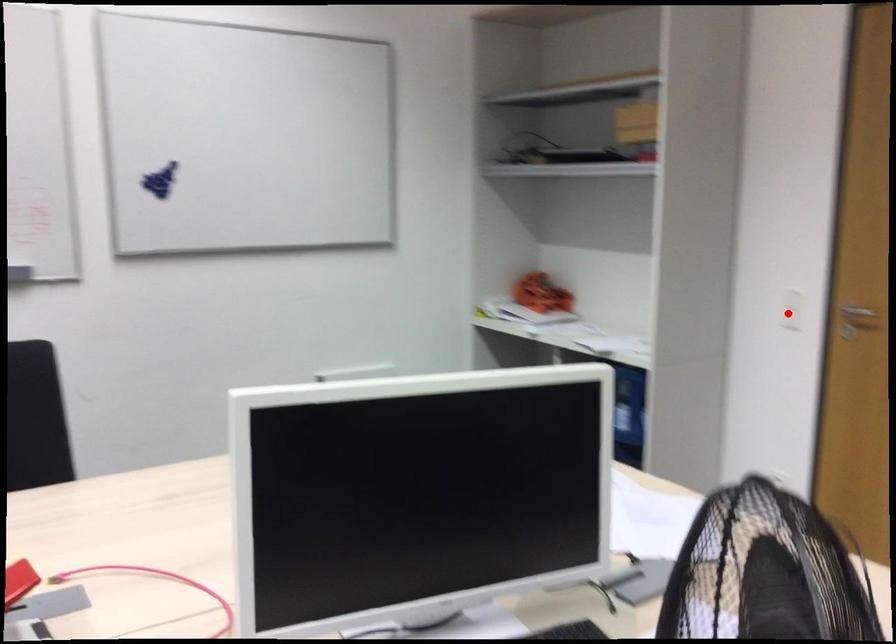
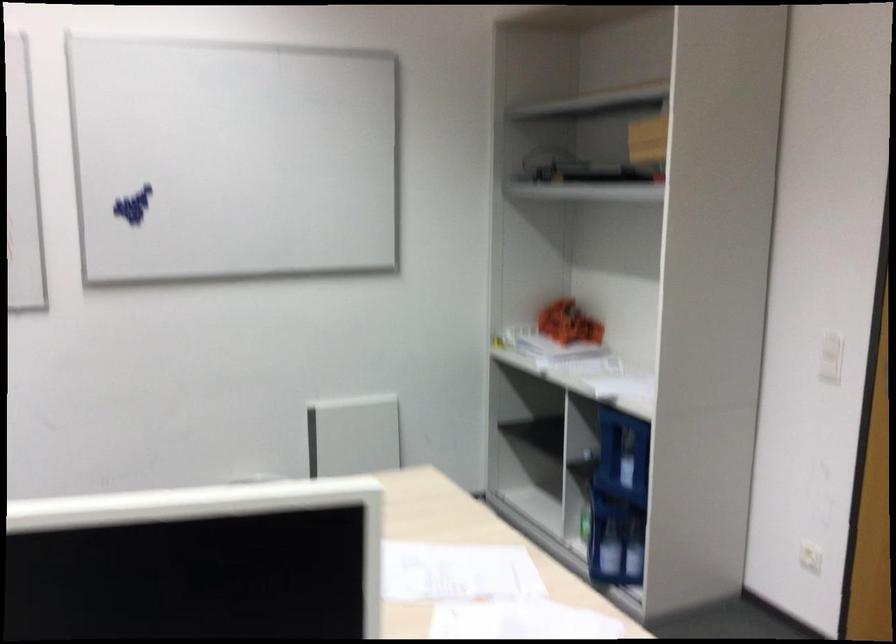
In the second image, find the point that corresponds to the highlighted location in the first image.

(830, 357)